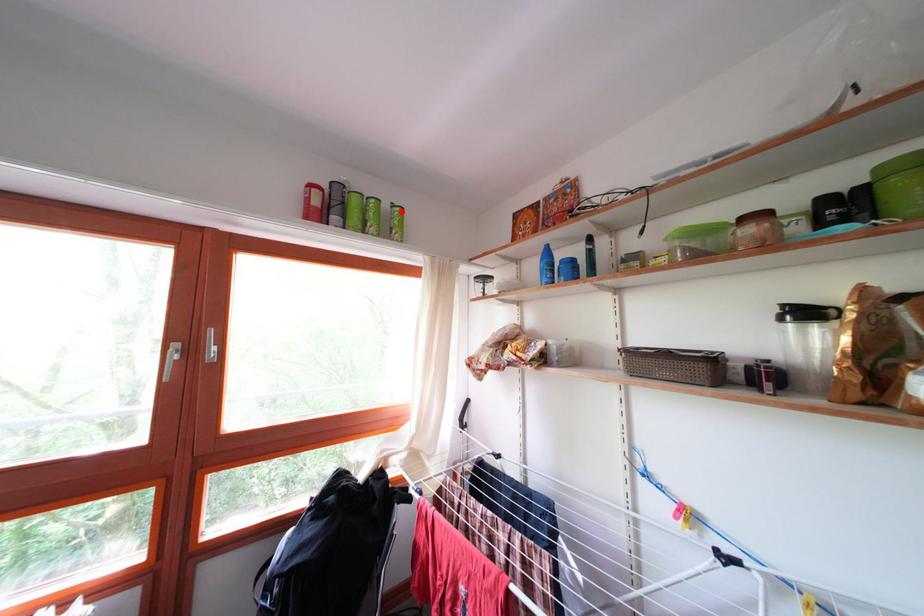
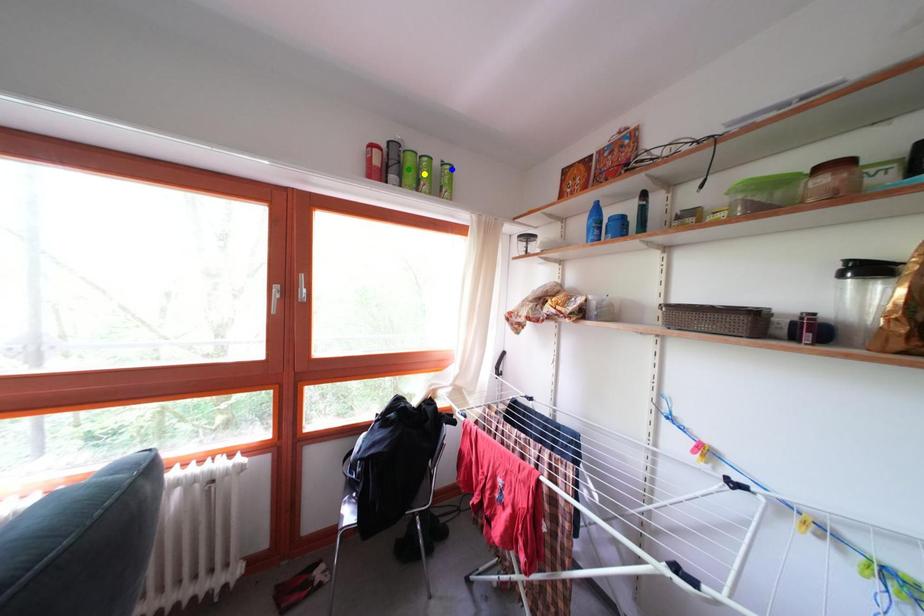
Question: I am providing you with two images of the same scene from different viewpoints. A red point is marked on the first image. You are given multiple points on the second image. Which spot in image 2 lines up with the point in image 1?

Choices:
 (A) yellow point
 (B) blue point
 (C) green point

Answer: (B)